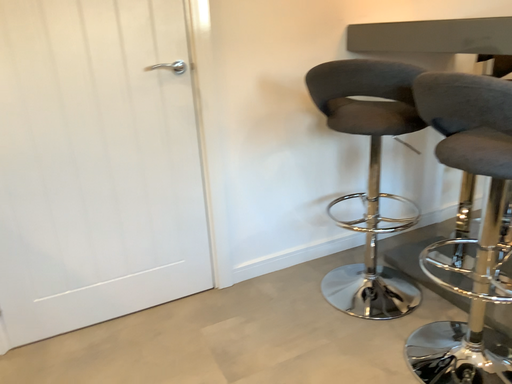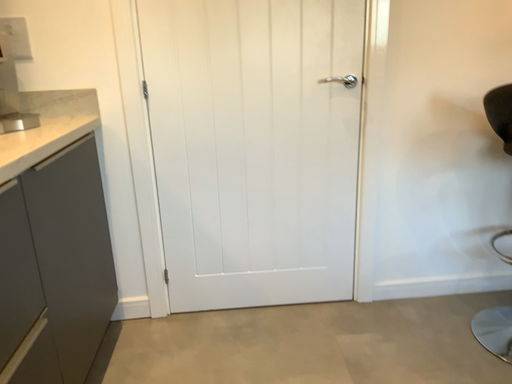
Question: How did the camera likely rotate when shooting the video?

Choices:
 (A) rotated right
 (B) rotated left

Answer: (B)